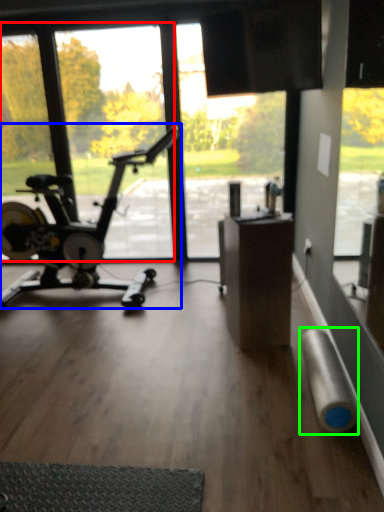
Question: Based on their relative distances, which object is farther from window screen (highlighted by a red box)? Choose from stationary bicycle (highlighted by a blue box) and duct tape (highlighted by a green box).

Choices:
 (A) stationary bicycle
 (B) duct tape

Answer: (B)